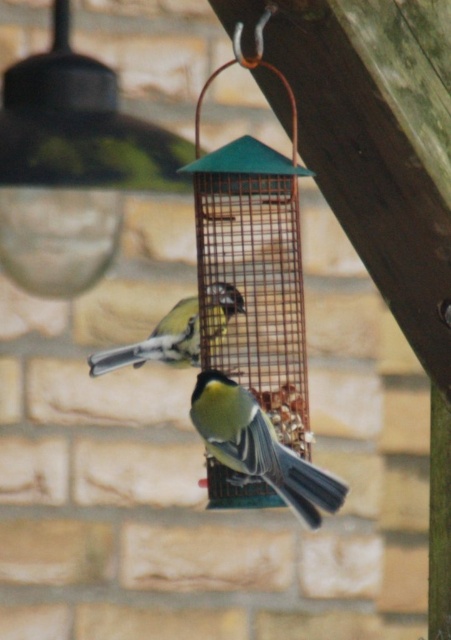
You are standing in front of the bird feeder and want to touch both points on the feeder. Which point should you reach for first, the point at coordinate (299, 316) or the point at coordinate (217, 416)?

You should reach for point (299, 316) first because it is closer to you than point (217, 416), which is further away.